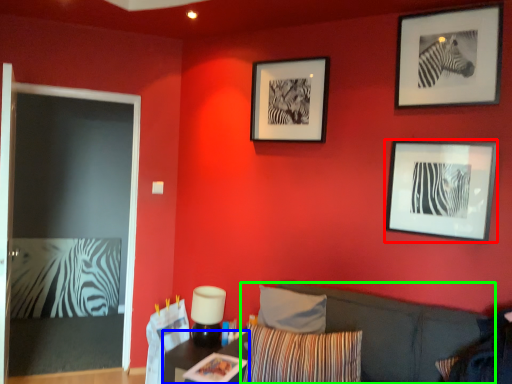
Question: Which object is the farthest from picture frame (highlighted by a red box)? Choose among these: table (highlighted by a blue box) or couch (highlighted by a green box).

Choices:
 (A) table
 (B) couch

Answer: (A)